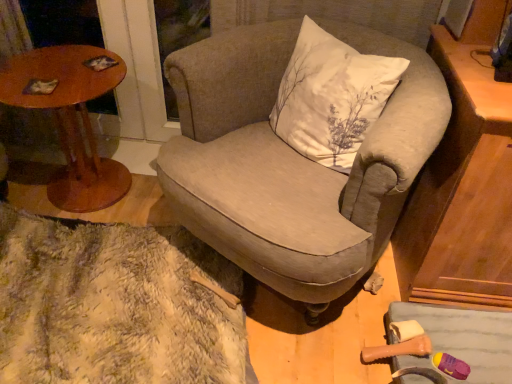
Question: From the image's perspective, is textured beige armchair at center located above matte brown cabinet at right?

Choices:
 (A) yes
 (B) no

Answer: (A)

Question: Is textured beige armchair at center oriented towards matte brown cabinet at right?

Choices:
 (A) yes
 (B) no

Answer: (B)

Question: Is textured beige armchair at center completely or partially outside of matte brown cabinet at right?

Choices:
 (A) yes
 (B) no

Answer: (A)

Question: From the image's perspective, does textured beige armchair at center appear lower than matte brown cabinet at right?

Choices:
 (A) no
 (B) yes

Answer: (A)

Question: Considering the relative sizes of textured beige armchair at center and matte brown cabinet at right in the image provided, is textured beige armchair at center bigger than matte brown cabinet at right?

Choices:
 (A) yes
 (B) no

Answer: (A)

Question: Is textured beige armchair at center positioned far away from matte brown cabinet at right?

Choices:
 (A) no
 (B) yes

Answer: (A)

Question: Considering the relative positions of matte brown cabinet at right and fuzzy beige rug at lower left in the image provided, is matte brown cabinet at right to the right of fuzzy beige rug at lower left from the viewer's perspective?

Choices:
 (A) yes
 (B) no

Answer: (A)

Question: Is matte brown cabinet at right with fuzzy beige rug at lower left?

Choices:
 (A) yes
 (B) no

Answer: (B)

Question: From the image's perspective, is matte brown cabinet at right located above fuzzy beige rug at lower left?

Choices:
 (A) no
 (B) yes

Answer: (B)

Question: Is matte brown cabinet at right far away from fuzzy beige rug at lower left?

Choices:
 (A) yes
 (B) no

Answer: (B)

Question: Is matte brown cabinet at right facing away from fuzzy beige rug at lower left?

Choices:
 (A) yes
 (B) no

Answer: (B)

Question: Does matte brown cabinet at right lie behind fuzzy beige rug at lower left?

Choices:
 (A) no
 (B) yes

Answer: (A)

Question: Does white cotton pillow at center have a greater height compared to wooden round table at left?

Choices:
 (A) yes
 (B) no

Answer: (B)